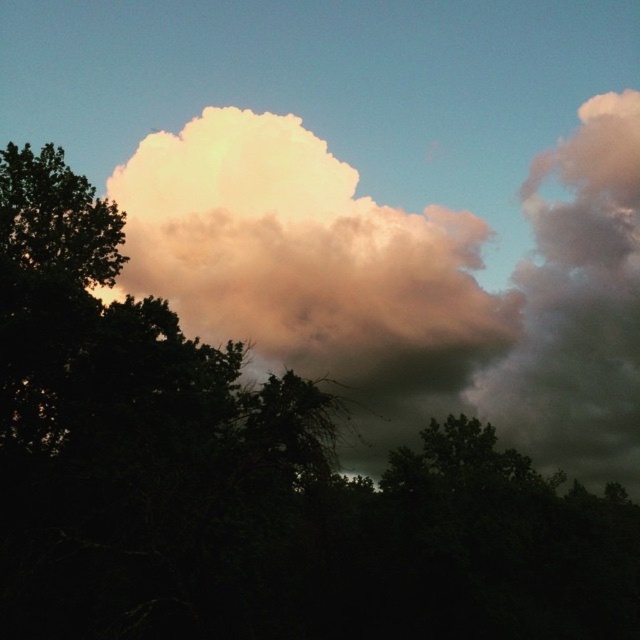
Question: Which object is closer to the camera taking this photo?

Choices:
 (A) white fluffy cloud at upper center
 (B) cloudy gray cloud at upper right

Answer: (A)

Question: Is white fluffy cloud at upper center to the right of cloudy gray cloud at upper right from the viewer's perspective?

Choices:
 (A) yes
 (B) no

Answer: (B)

Question: Can you confirm if white fluffy cloud at upper center is wider than cloudy gray cloud at upper right?

Choices:
 (A) no
 (B) yes

Answer: (B)

Question: Does white fluffy cloud at upper center have a lesser width compared to cloudy gray cloud at upper right?

Choices:
 (A) no
 (B) yes

Answer: (A)

Question: Which point is closer to the camera taking this photo?

Choices:
 (A) [179, 289]
 (B) [540, 298]

Answer: (A)